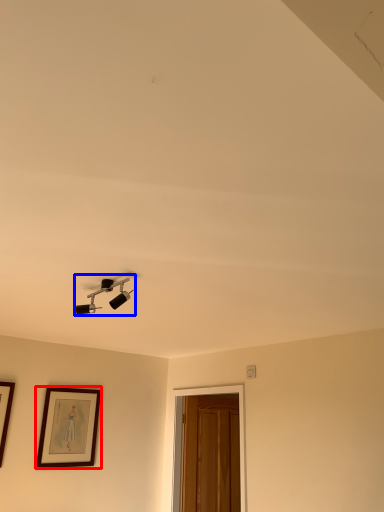
Question: Which of the following is the closest to the observer, picture frame (highlighted by a red box) or lamp (highlighted by a blue box)?

Choices:
 (A) picture frame
 (B) lamp

Answer: (B)